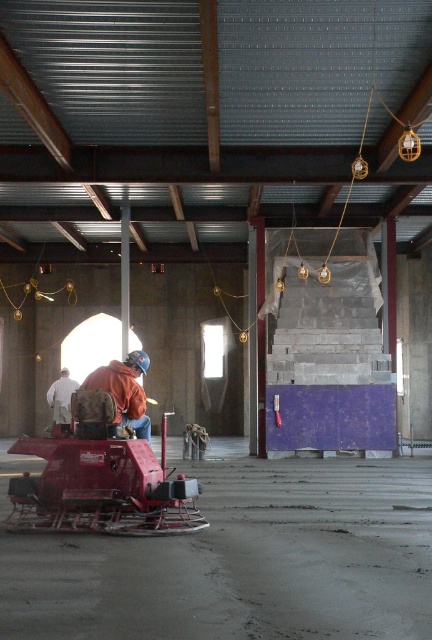
Between brown leather backpack at center and white fabric at center, which one appears on the right side from the viewer's perspective?

brown leather backpack at center

Who is higher up, brown leather backpack at center or white fabric at center?

brown leather backpack at center is above.

At what (x,y) coordinates should I click in order to perform the action: click on brown leather backpack at center. Please return your answer as a coordinate pair (x, y). This screenshot has width=432, height=640. Looking at the image, I should click on (124, 390).